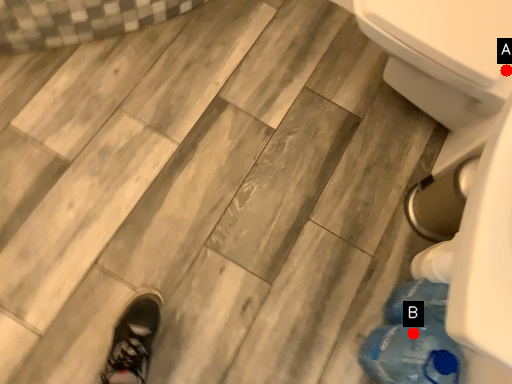
Question: Two points are circled on the image, labeled by A and B beside each circle. Which of the following is the farthest from the observer?

Choices:
 (A) A is further
 (B) B is further

Answer: (A)